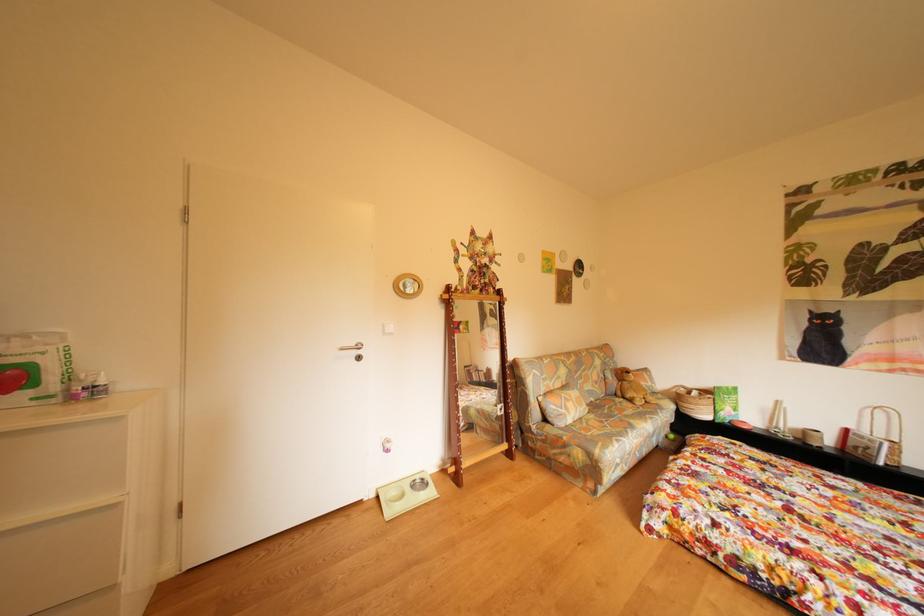
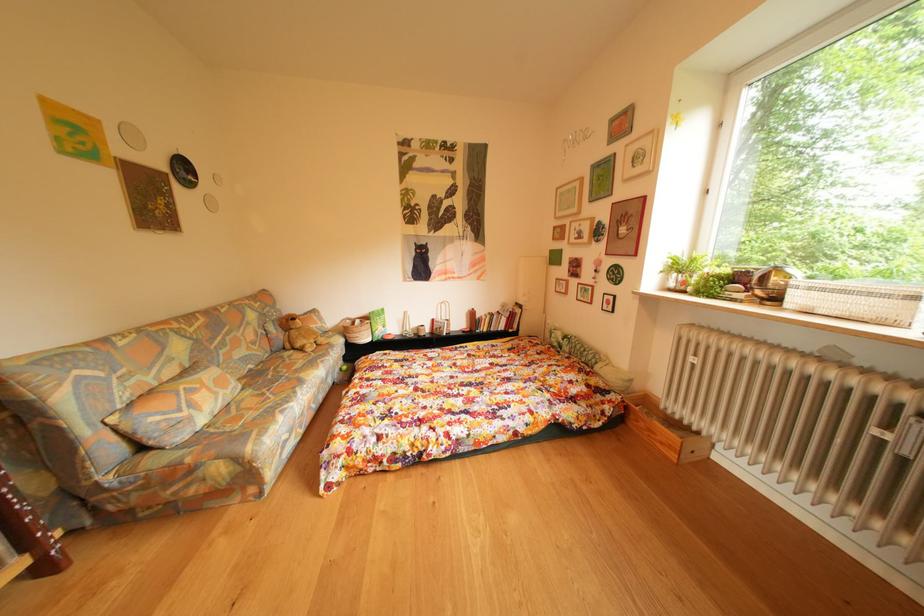
Question: How did the camera likely rotate?

Choices:
 (A) Left
 (B) Right
 (C) Up
 (D) Down

Answer: (B)